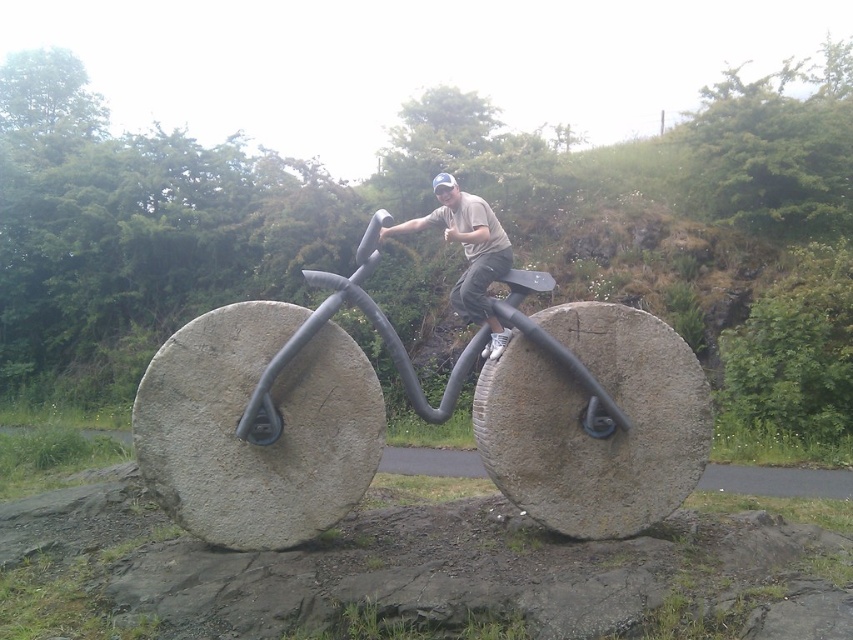
You are standing in front of two bicycles in the sculpture garden. The gray stone bicycle at center and the matte gray bicycle at center are both in view. Which one is positioned more to the left?

The gray stone bicycle at center is positioned more to the left than the matte gray bicycle at center.

You are a photographer standing in front of the gray stone bicycle at center and the matte gray bicycle at center. You want to capture a photo that shows both bicycles in the frame. Which bicycle should you position closer to the camera to ensure both are fully visible?

The gray stone bicycle at center is much taller than the matte gray bicycle at center, so positioning the taller gray stone bicycle at center closer to the camera will help balance their apparent sizes in the photo, ensuring both are fully visible.

You are standing in front of the sculpture and want to take a photo of both the gray stone bicycle at center and the matte gray bicycle at center. Which one is positioned lower in the image?

The gray stone bicycle at center is positioned lower than the matte gray bicycle at center.